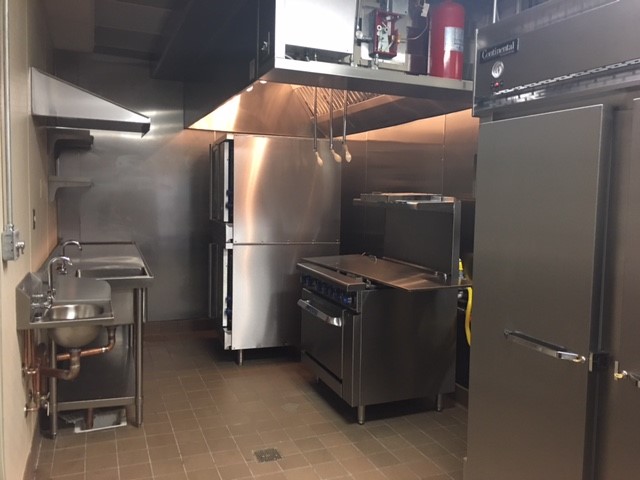
At what (x,y) coordinates should I click in order to perform the action: click on door handle. Please return your answer as a coordinate pair (x, y). The width and height of the screenshot is (640, 480). Looking at the image, I should click on click(x=536, y=339), click(x=627, y=374), click(x=317, y=315).